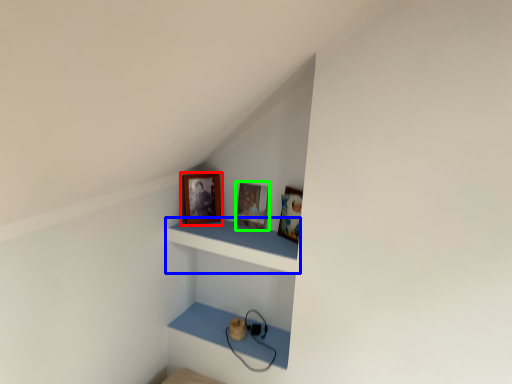
Question: Considering the real-world distances, which object is farthest from picture frame (highlighted by a red box)? shelf (highlighted by a blue box) or picture frame (highlighted by a green box)?

Choices:
 (A) shelf
 (B) picture frame

Answer: (A)